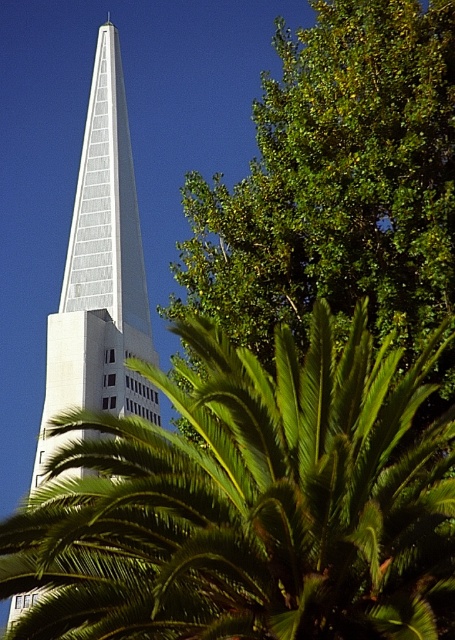
You are standing in front of the glassy white spire at center and want to take a photo of the green leafy tree at upper right. Which direction should you turn to face the tree?

The green leafy tree at upper right is positioned on the right side of the glassy white spire at center, so you should turn to your right to face the tree.